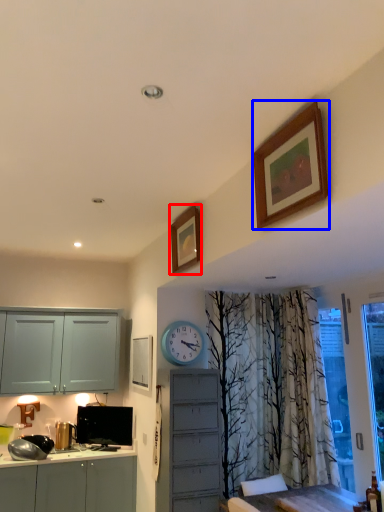
Question: Which object appears closest to the camera in this image, picture frame (highlighted by a red box) or picture frame (highlighted by a blue box)?

Choices:
 (A) picture frame
 (B) picture frame

Answer: (B)